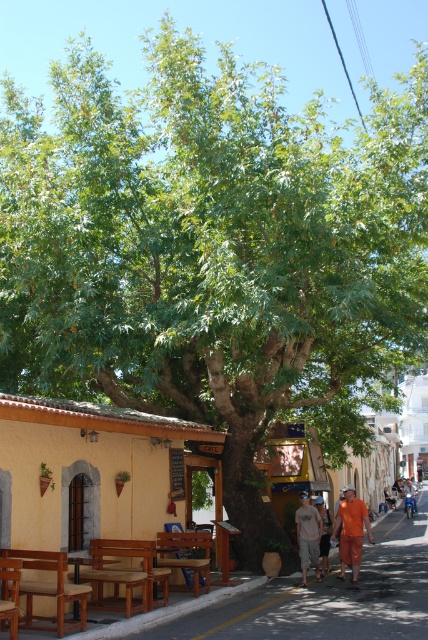
Consider the image. You are standing at the point marked as point (351, 531) in the image. What object are you standing on?

You are standing on orange cotton shorts at center.

You are a pedestrian walking on the street and see the brown wooden picnic table at center and the orange cotton shirt at center. Which object is positioned higher from the ground?

The brown wooden picnic table at center is above the orange cotton shirt at center, so the picnic table is higher from the ground.